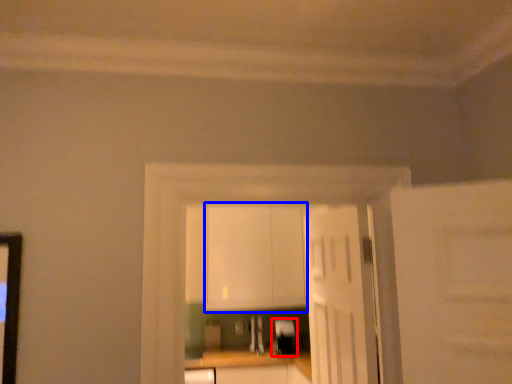
Question: Which of the following is the closest to the observer, appliance (highlighted by a red box) or cabinetry (highlighted by a blue box)?

Choices:
 (A) appliance
 (B) cabinetry

Answer: (B)